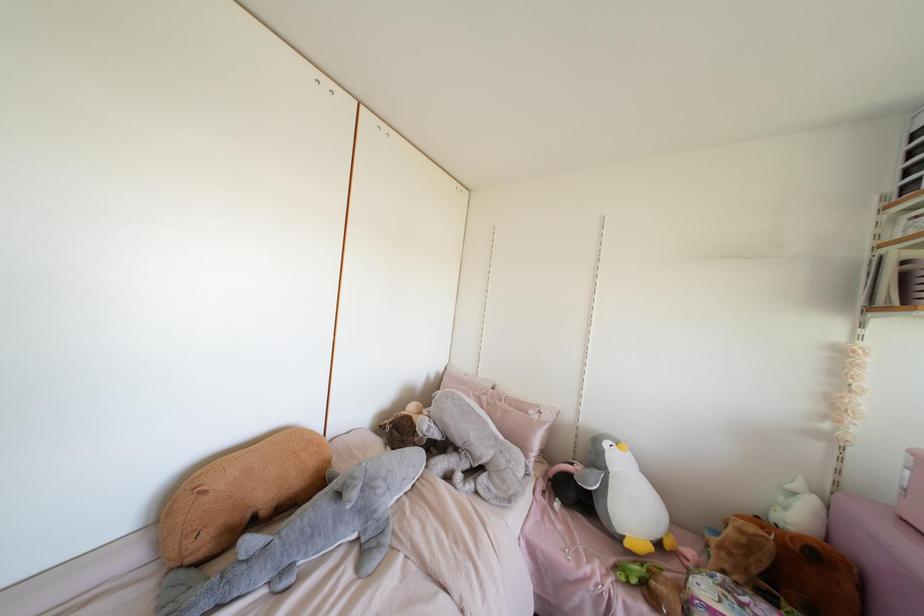
Image resolution: width=924 pixels, height=616 pixels. What are the coordinates of `grey stuffed animal` in the screenshot? It's located at (304, 536).